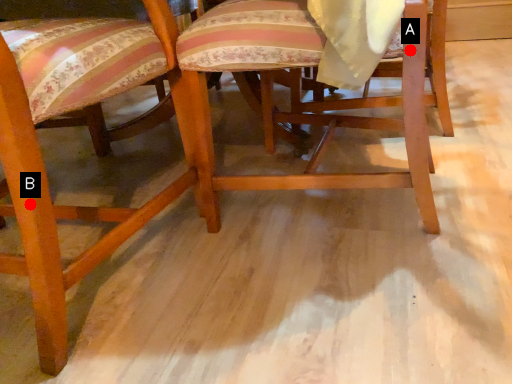
Question: Two points are circled on the image, labeled by A and B beside each circle. Which of the following is the farthest from the observer?

Choices:
 (A) A is further
 (B) B is further

Answer: (A)